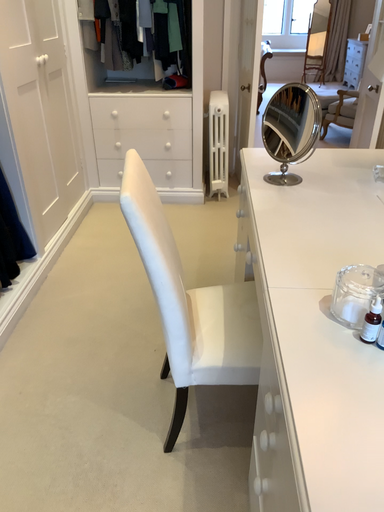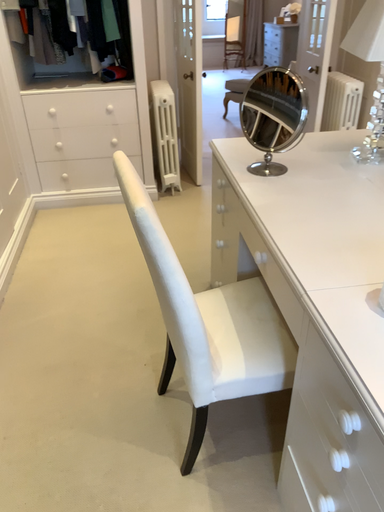
Question: How did the camera likely rotate when shooting the video?

Choices:
 (A) rotated left
 (B) rotated right

Answer: (B)